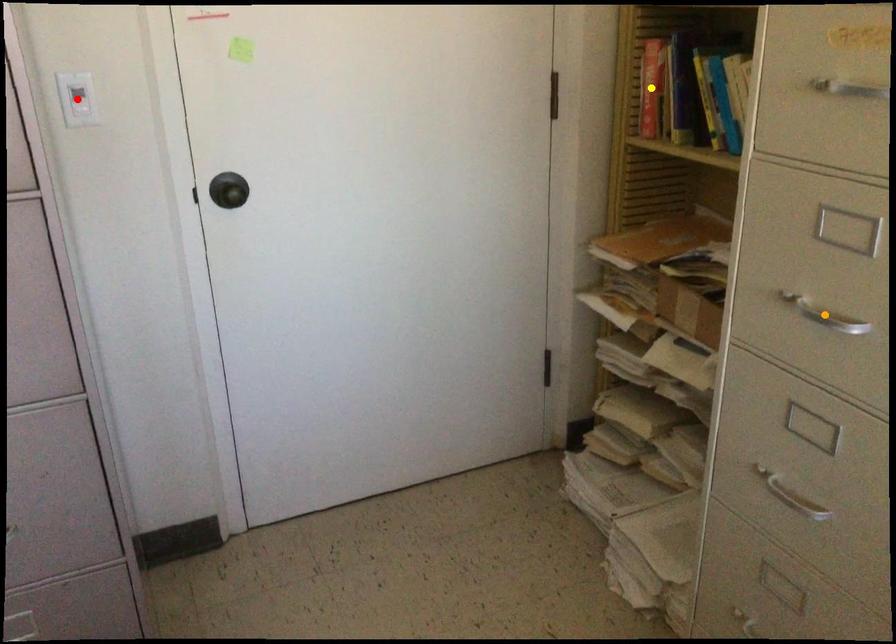
Based on the photo, order these from nearest to farthest:
- yellow point
- orange point
- red point

orange point
red point
yellow point